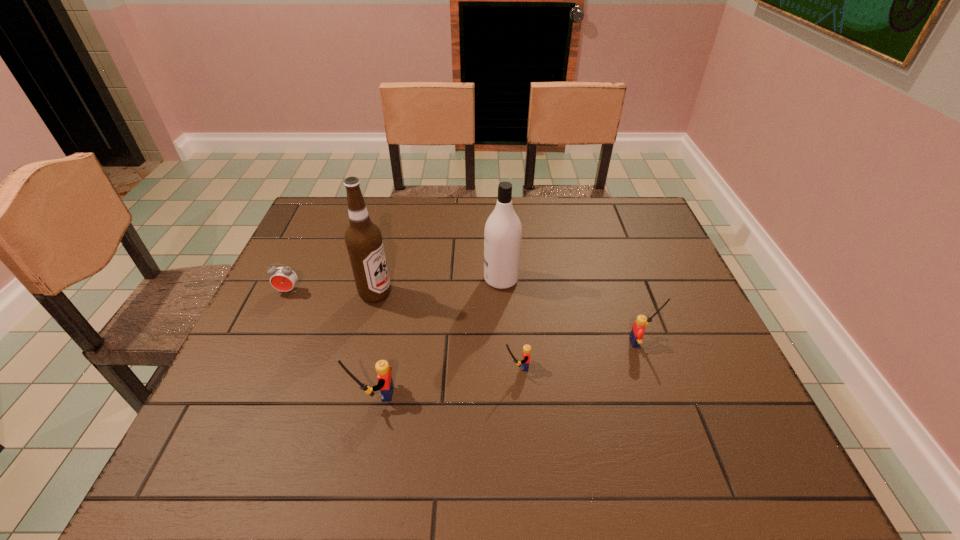
Where is `free space located 0.350m on the face of the alarm clock`? free space located 0.350m on the face of the alarm clock is located at coordinates (231, 414).

Locate an element on the screen. The height and width of the screenshot is (540, 960). object positioned at the near edge is located at coordinates (385, 383).

The height and width of the screenshot is (540, 960). I want to click on object that is at the left edge, so click(x=284, y=279).

This screenshot has height=540, width=960. Identify the location of object at the right edge. (638, 328).

In the image, there is a desktop. What are the coordinates of `vacant space at the far edge` in the screenshot? It's located at (457, 239).

Locate an element on the screen. The width and height of the screenshot is (960, 540). vacant area at the near edge is located at coordinates (514, 393).

Where is `vacant region at the left edge of the desktop`? vacant region at the left edge of the desktop is located at coordinates (328, 249).

In the image, there is a desktop. What are the coordinates of `free space at the far left corner` in the screenshot? It's located at (310, 213).

At what (x,y) coordinates should I click in order to perform the action: click on free space at the far right corner of the desktop. Please return your answer as a coordinate pair (x, y). Looking at the image, I should click on (629, 207).

Find the location of a particular element. free point between the leftmost object and the second tallest Lego is located at coordinates (467, 316).